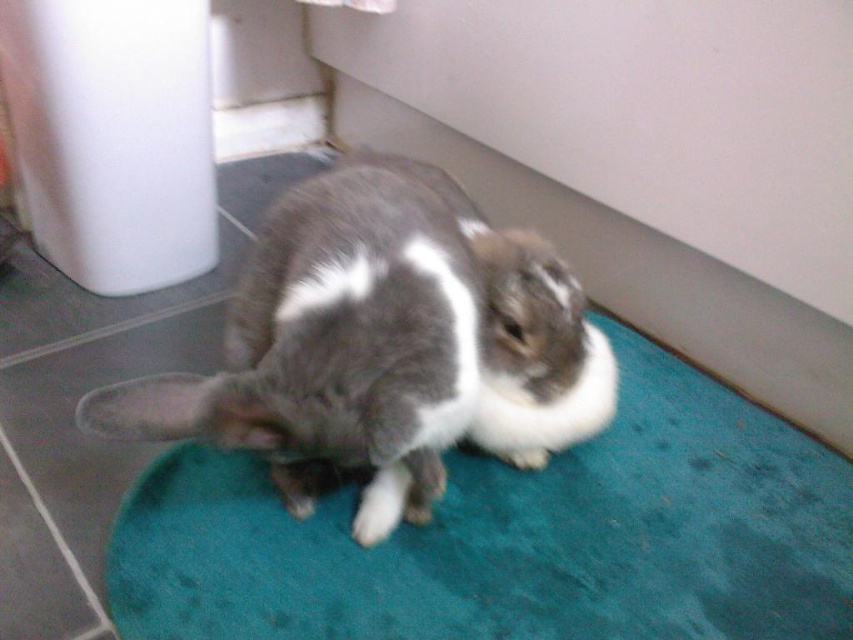
Question: Is gray soft fur rabbit at center below gray and white fur rabbit at center?

Choices:
 (A) no
 (B) yes

Answer: (A)

Question: Based on their relative distances, which object is nearer to the gray and white fur rabbit at center?

Choices:
 (A) teal carpet at center
 (B) gray soft fur rabbit at center

Answer: (B)

Question: Is teal carpet at center positioned before gray and white fur rabbit at center?

Choices:
 (A) no
 (B) yes

Answer: (B)

Question: Which point is closer to the camera?

Choices:
 (A) gray and white fur rabbit at center
 (B) teal carpet at center
 (C) gray soft fur rabbit at center

Answer: (C)

Question: Which point is closer to the camera?

Choices:
 (A) teal carpet at center
 (B) gray and white fur rabbit at center
 (C) gray soft fur rabbit at center

Answer: (C)

Question: Considering the relative positions of gray soft fur rabbit at center and gray and white fur rabbit at center in the image provided, where is gray soft fur rabbit at center located with respect to gray and white fur rabbit at center?

Choices:
 (A) left
 (B) right

Answer: (A)